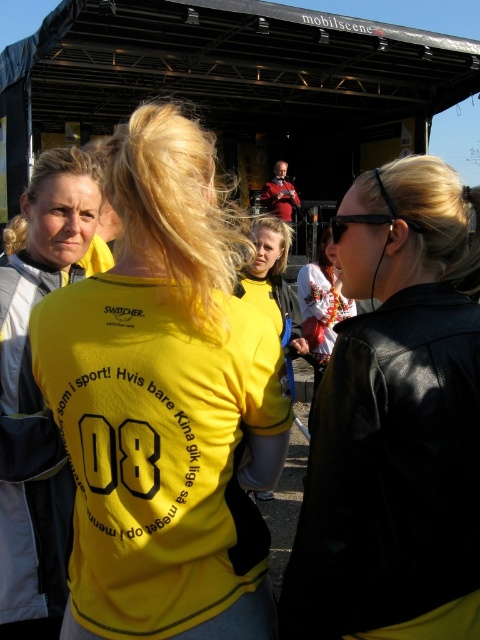
You are at the coordinates 0.0, 0.0 in the image. You want to find the yellow matte shirt at left. In which direction should you move to reach it?

Since the yellow matte shirt at left is at point (44,264), you should move towards the right and slightly upwards to reach it.

You are a photographer at the event and want to capture both the black leather jacket at upper right and the yellow matte shirt at left in a single frame. Which object should you focus on first to ensure both are in the frame?

The black leather jacket at upper right is smaller than the yellow matte shirt at left, so you should focus on the yellow matte shirt at left first to ensure both are in the frame.

Consider the image. You are at an outdoor event and see a black leather jacket at upper right and a yellow matte shirt at left. Which one is positioned to the right of the other?

The black leather jacket at upper right is positioned to the right of the yellow matte shirt at left.